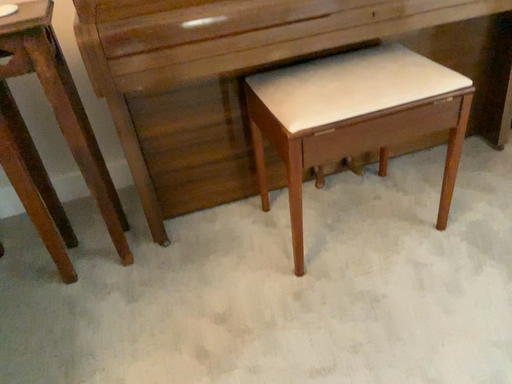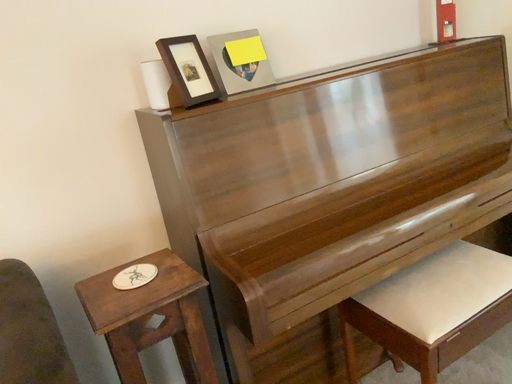
Question: How did the camera likely rotate when shooting the video?

Choices:
 (A) rotated upward
 (B) rotated downward

Answer: (A)